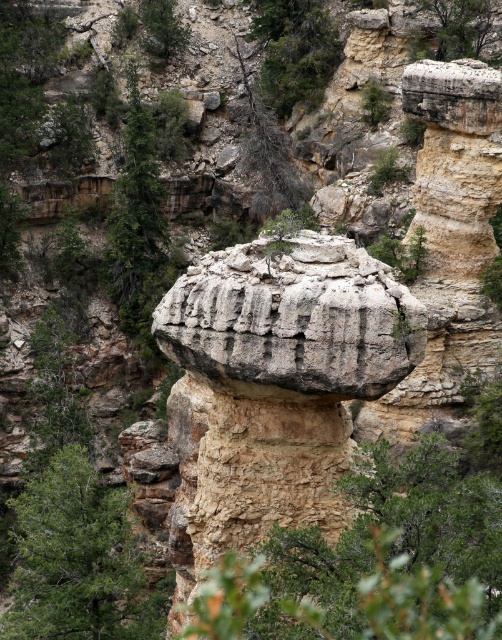
Between green leafy tree at lower left and green leafy tree at upper center, which one has more height?

With more height is green leafy tree at lower left.

Is green leafy tree at lower left shorter than green leafy tree at upper center?

No.

Measure the distance between point (79, 516) and camera.

The distance of point (79, 516) from camera is 37.30 meters.

Find the location of a particular element. The image size is (502, 640). green leafy tree at lower left is located at coordinates (78, 561).

Does green leafy tree at upper right have a lesser width compared to green leafy tree at upper center?

Correct, green leafy tree at upper right's width is less than green leafy tree at upper center's.

Measure the distance between green leafy tree at upper right and camera.

green leafy tree at upper right is 77.44 meters from camera.

Identify the location of green leafy tree at upper right. This screenshot has height=640, width=502. (458, 26).

Which is below, green rough tree at upper left or green leafy tree at upper right?

Positioned lower is green rough tree at upper left.

Between point (152, 216) and point (469, 1), which one is positioned behind?

The point (152, 216) is more distant.

Locate an element on the screen. This screenshot has height=640, width=502. green rough tree at upper left is located at coordinates (138, 220).